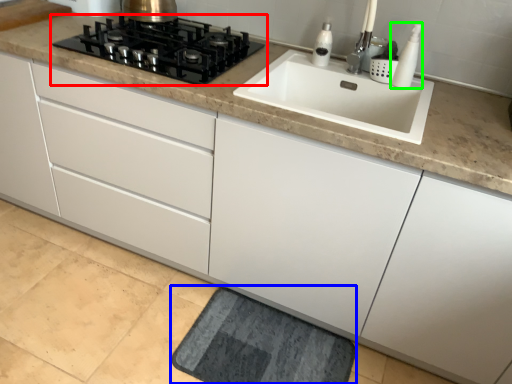
Question: Estimate the real-world distances between objects in this image. Which object is closer to gas stove (highlighted by a red box), bath mat (highlighted by a blue box) or soap dispenser (highlighted by a green box)?

Choices:
 (A) bath mat
 (B) soap dispenser

Answer: (B)